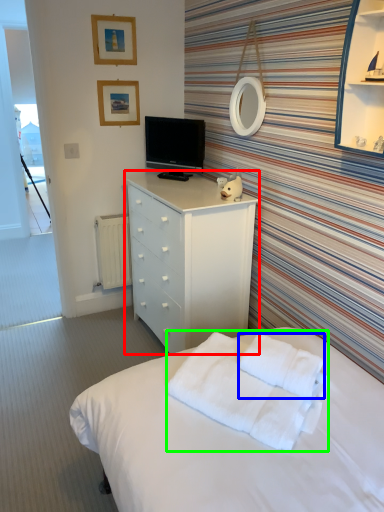
Question: Which is nearer to the chest of drawers (highlighted by a red box)? cloth (highlighted by a blue box) or blanket (highlighted by a green box).

Choices:
 (A) cloth
 (B) blanket

Answer: (B)